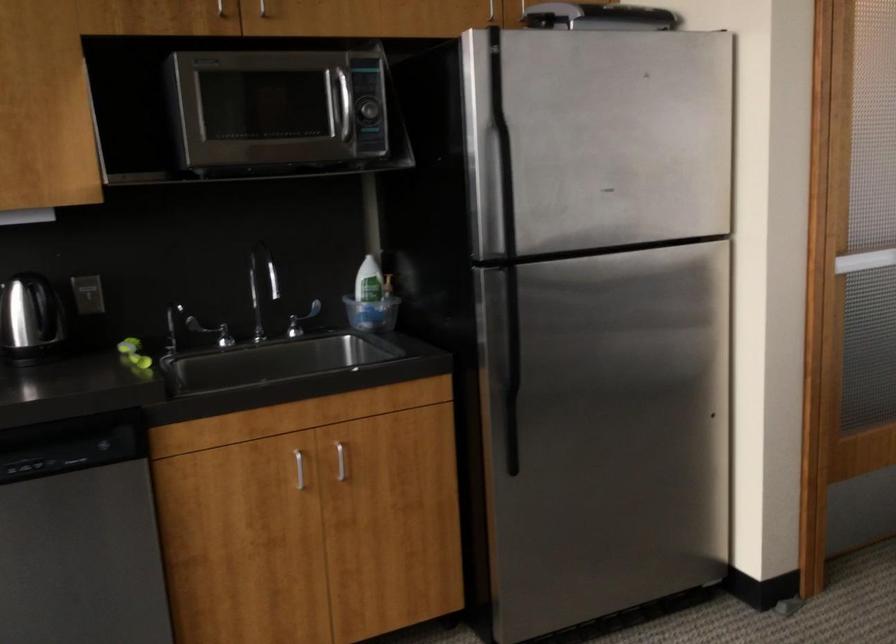
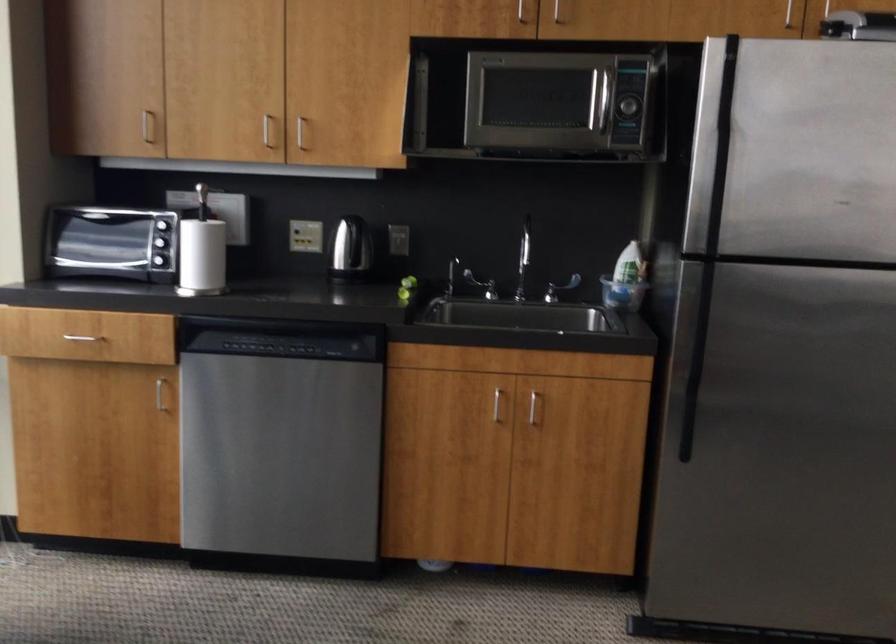
The point at (373, 313) is marked in the first image. Where is the corresponding point in the second image?

(622, 294)